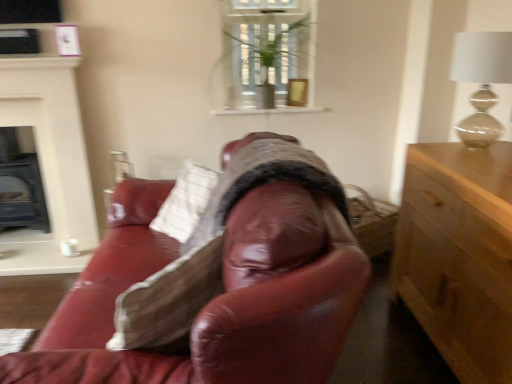
Question: From a real-world perspective, is white painted wood fireplace at left on green leafy plant at upper center?

Choices:
 (A) yes
 (B) no

Answer: (B)

Question: Considering the relative sizes of white painted wood fireplace at left and green leafy plant at upper center in the image provided, is white painted wood fireplace at left bigger than green leafy plant at upper center?

Choices:
 (A) no
 (B) yes

Answer: (B)

Question: From the image's perspective, is white painted wood fireplace at left located beneath green leafy plant at upper center?

Choices:
 (A) yes
 (B) no

Answer: (A)

Question: Could green leafy plant at upper center be considered to be inside white painted wood fireplace at left?

Choices:
 (A) yes
 (B) no

Answer: (B)

Question: Does white painted wood fireplace at left lie behind green leafy plant at upper center?

Choices:
 (A) no
 (B) yes

Answer: (A)

Question: Looking at the image, does matte beige lamp at upper right seem bigger or smaller compared to green leafy plant at upper center?

Choices:
 (A) small
 (B) big

Answer: (B)

Question: Considering the positions of matte beige lamp at upper right and green leafy plant at upper center in the image, is matte beige lamp at upper right taller or shorter than green leafy plant at upper center?

Choices:
 (A) short
 (B) tall

Answer: (A)

Question: Relative to green leafy plant at upper center, is matte beige lamp at upper right in front or behind?

Choices:
 (A) front
 (B) behind

Answer: (A)

Question: Is matte beige lamp at upper right inside or outside of green leafy plant at upper center?

Choices:
 (A) outside
 (B) inside

Answer: (A)

Question: Is matte beige lamp at upper right taller or shorter than white matte candle at left?

Choices:
 (A) tall
 (B) short

Answer: (A)

Question: From a real-world perspective, is matte beige lamp at upper right physically located above or below white matte candle at left?

Choices:
 (A) above
 (B) below

Answer: (A)

Question: From the image's perspective, relative to white matte candle at left, is matte beige lamp at upper right above or below?

Choices:
 (A) above
 (B) below

Answer: (A)

Question: Considering their positions, is matte beige lamp at upper right located in front of or behind white matte candle at left?

Choices:
 (A) behind
 (B) front

Answer: (B)

Question: Would you say light wood cabinet at right is inside or outside matte beige lamp at upper right?

Choices:
 (A) inside
 (B) outside

Answer: (B)

Question: In terms of height, does light wood cabinet at right look taller or shorter compared to matte beige lamp at upper right?

Choices:
 (A) short
 (B) tall

Answer: (B)